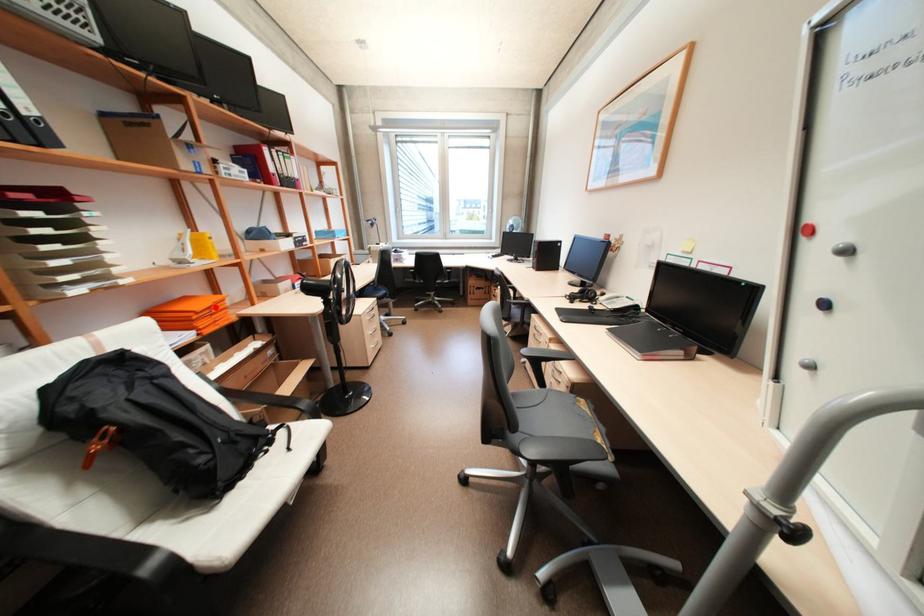
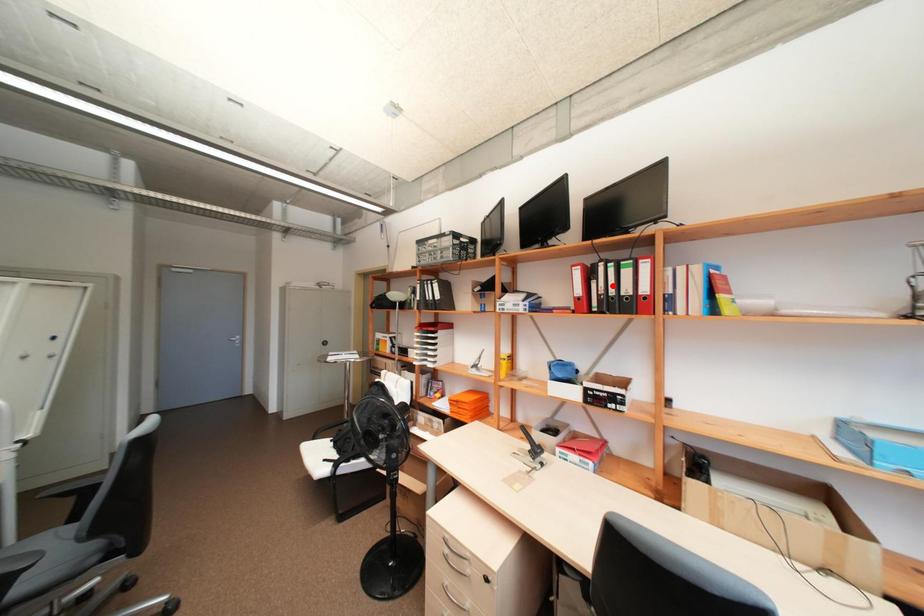
I am providing you with two images of the same scene from different viewpoints. A red point is marked on the first image and another point is marked on the second image. Do the highlighted points in image1 and image2 indicate the same real-world spot?

No